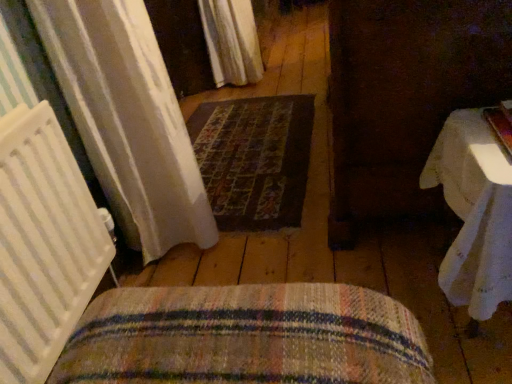
Question: Is white sheer curtain at upper center surrounded by woven fabric cushion at lower center?

Choices:
 (A) no
 (B) yes

Answer: (A)

Question: From the image's perspective, is woven fabric cushion at lower center located beneath white sheer curtain at upper center?

Choices:
 (A) yes
 (B) no

Answer: (A)

Question: Can you confirm if woven fabric cushion at lower center is thinner than white sheer curtain at upper center?

Choices:
 (A) yes
 (B) no

Answer: (B)

Question: Is woven fabric cushion at lower center in front of white sheer curtain at upper center?

Choices:
 (A) yes
 (B) no

Answer: (A)

Question: Can you confirm if woven fabric cushion at lower center is bigger than white sheer curtain at upper center?

Choices:
 (A) no
 (B) yes

Answer: (A)

Question: Does point (465, 115) appear closer or farther from the camera than point (212, 61)?

Choices:
 (A) closer
 (B) farther

Answer: (A)

Question: Would you say white cloth-covered table at right is inside or outside white sheer curtain at upper center?

Choices:
 (A) inside
 (B) outside

Answer: (B)

Question: Considering the positions of white cloth-covered table at right and white sheer curtain at upper center in the image, is white cloth-covered table at right wider or thinner than white sheer curtain at upper center?

Choices:
 (A) thin
 (B) wide

Answer: (B)

Question: Considering their positions, is white cloth-covered table at right located in front of or behind white sheer curtain at upper center?

Choices:
 (A) behind
 (B) front

Answer: (B)

Question: From the image's perspective, relative to white cloth-covered table at right, is dark brown woven mat at center above or below?

Choices:
 (A) below
 (B) above

Answer: (B)

Question: Is dark brown woven mat at center in front of or behind white cloth-covered table at right in the image?

Choices:
 (A) front
 (B) behind

Answer: (B)

Question: Looking at the image, does dark brown woven mat at center seem bigger or smaller compared to white cloth-covered table at right?

Choices:
 (A) small
 (B) big

Answer: (A)

Question: Is point (246, 152) positioned closer to the camera than point (459, 216)?

Choices:
 (A) closer
 (B) farther

Answer: (B)

Question: Do you think white sheer curtain at upper center is within woven fabric cushion at lower center, or outside of it?

Choices:
 (A) inside
 (B) outside

Answer: (B)

Question: In terms of size, does white sheer curtain at upper center appear bigger or smaller than woven fabric cushion at lower center?

Choices:
 (A) big
 (B) small

Answer: (A)